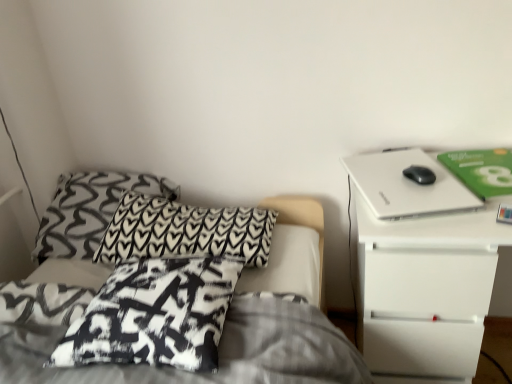
This screenshot has height=384, width=512. Find the location of `free location to the left of black matte mouse at right`. free location to the left of black matte mouse at right is located at coordinates (377, 181).